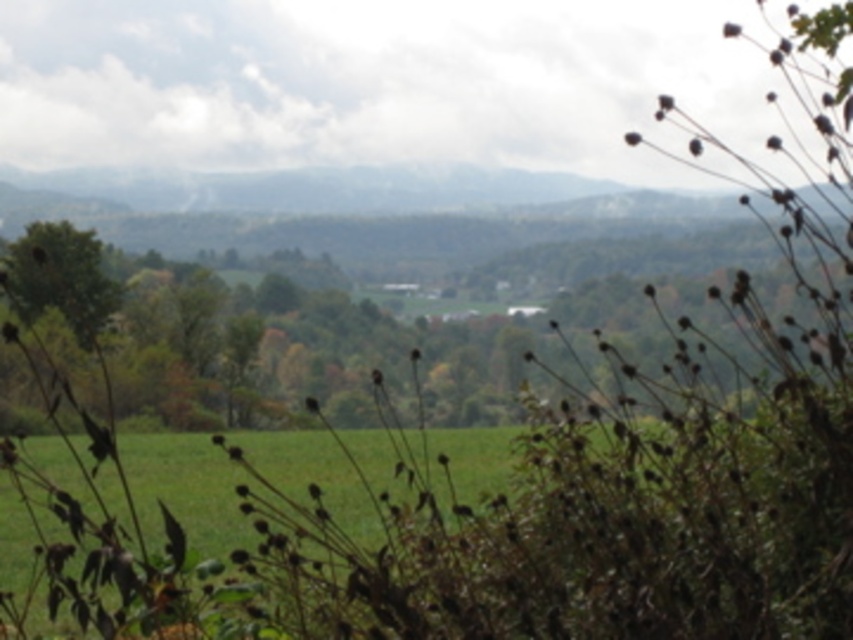
Who is taller, green grass at center or green leafy tree at left?

green leafy tree at left is taller.

Identify the location of green grass at center. The width and height of the screenshot is (853, 640). (186, 484).

Is point (32, 243) positioned before point (384, 452)?

No, (32, 243) is further to viewer.

Is green matte tree at center bigger than green grass at center?

Yes, green matte tree at center is bigger than green grass at center.

Which is behind, point (268, 356) or point (480, 438)?

Positioned behind is point (268, 356).

Where is `green matte tree at center`? The width and height of the screenshot is (853, 640). green matte tree at center is located at coordinates (251, 339).

Can you confirm if green matte tree at center is positioned below green leafy tree at left?

Correct, green matte tree at center is located below green leafy tree at left.

How much distance is there between green matte tree at center and green leafy tree at left?

green matte tree at center is 3.49 meters from green leafy tree at left.

Between point (62, 308) and point (27, 292), which one is positioned in front?

Positioned in front is point (62, 308).

Identify the location of green matte tree at center. (251, 339).